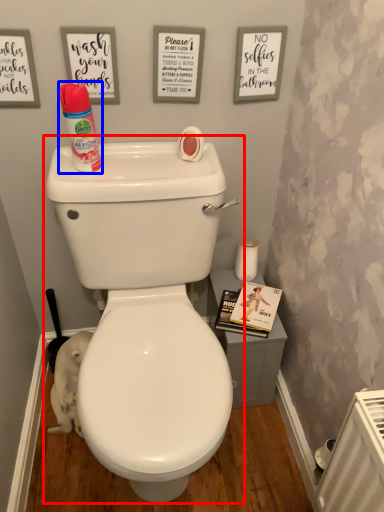
Question: Among these objects, which one is nearest to the camera, toilet (highlighted by a red box) or cleaning product (highlighted by a blue box)?

Choices:
 (A) toilet
 (B) cleaning product

Answer: (A)